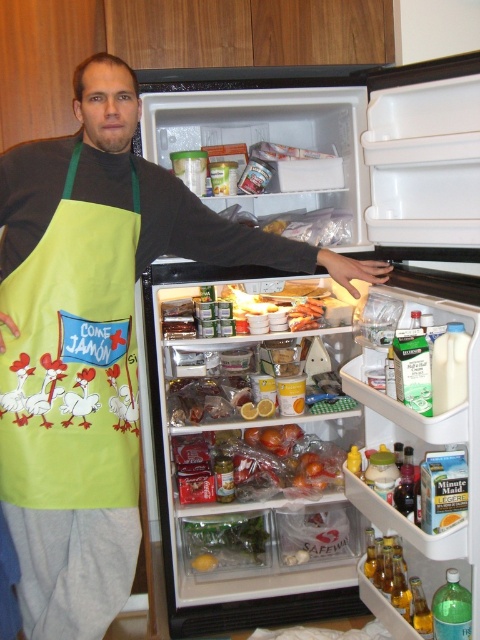
You are a guest at a dinner party and see the matte plastic refrigerator at center and the green fabric apron at left. Which object is closer to the right side of the image?

The matte plastic refrigerator at center is to the right of green fabric apron at left, so it is closer to the right side of the image.

You are trying to decide whether to hang a picture frame on the matte plastic refrigerator at center or the green fabric apron at left. Which surface can support a heavier item based on their sizes?

The matte plastic refrigerator at center has a greater height compared to green fabric apron at left, so it can support a heavier item.

You are a delivery person carrying a large box that is 1.5 meters wide. You need to place it in front of the matte plastic refrigerator at center. Can you position it without moving the refrigerator?

The distance between the matte plastic refrigerator at center and the camera is 1.44 meters. Since the box is 1.5 meters wide, it cannot be placed in front of the refrigerator without overlapping or moving the refrigerator.